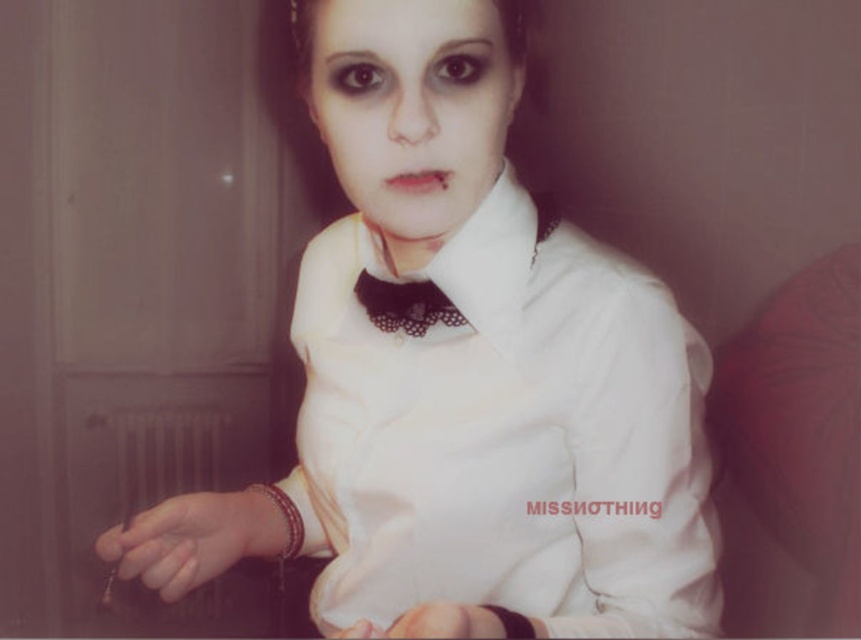
You are an artist planning to paint a portrait of the person in the image. You want to ensure the proportions are accurate. Given that the matte white face at center is much taller than the black lace bow tie at center, which object should you make larger in your painting?

The matte white face at center should be made larger in the painting since it is much taller than the black lace bow tie at center according to the description.